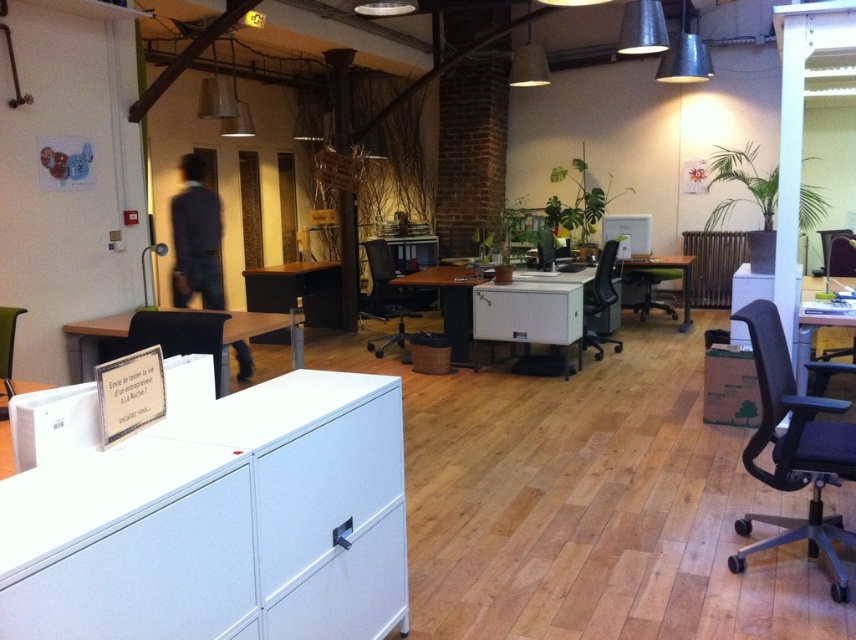
Measure the distance from matte black chair at left to matte black office chair at center.

matte black chair at left is 12.87 feet from matte black office chair at center.

Between matte black chair at left and matte black office chair at center, which one has less height?

matte black chair at left

Between point (217, 368) and point (586, 310), which one is positioned behind?

The point (586, 310) is behind.

This screenshot has width=856, height=640. What are the coordinates of `matte black chair at left` in the screenshot? It's located at (177, 333).

Is white matte file cabinet at lower left thinner than white laminate table at center?

Yes, white matte file cabinet at lower left is thinner than white laminate table at center.

Between white matte file cabinet at lower left and white laminate table at center, which one is positioned higher?

white laminate table at center is above.

The width and height of the screenshot is (856, 640). I want to click on white matte file cabinet at lower left, so click(220, 524).

Can you confirm if white glossy table at right is positioned to the left of matte black office chair at center?

No, white glossy table at right is not to the left of matte black office chair at center.

Measure the distance between white glossy table at right and matte black office chair at center.

They are 6.11 feet apart.

Between point (813, 298) and point (586, 285), which one is positioned behind?

Positioned behind is point (586, 285).

You are a GUI agent. You are given a task and a screenshot of the screen. Output one action in this format:
    pyautogui.click(x=<x>, y=<y>)
    Task: Click on the white glossy table at right
    The height and width of the screenshot is (640, 856).
    Given the screenshot: What is the action you would take?
    pyautogui.click(x=816, y=326)